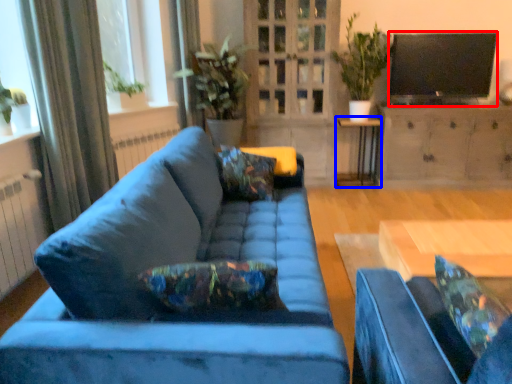
Question: Which of the following is the closest to the observer, television (highlighted by a red box) or side table (highlighted by a blue box)?

Choices:
 (A) television
 (B) side table

Answer: (A)